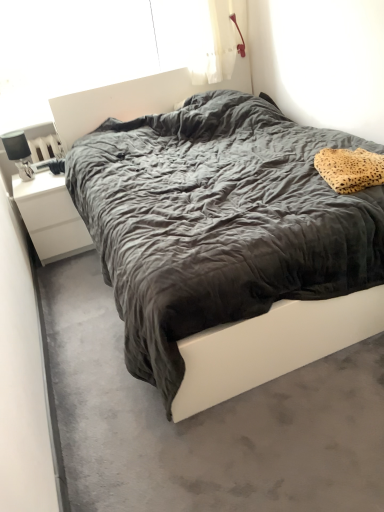
Question: Is velvet dark gray bed at center aimed at leopard print fabric pillow at upper right?

Choices:
 (A) yes
 (B) no

Answer: (A)

Question: From the image's perspective, is velvet dark gray bed at center on top of leopard print fabric pillow at upper right?

Choices:
 (A) yes
 (B) no

Answer: (A)

Question: Are velvet dark gray bed at center and leopard print fabric pillow at upper right beside each other?

Choices:
 (A) no
 (B) yes

Answer: (A)

Question: Can you confirm if velvet dark gray bed at center is wider than leopard print fabric pillow at upper right?

Choices:
 (A) no
 (B) yes

Answer: (B)

Question: Considering the relative sizes of velvet dark gray bed at center and leopard print fabric pillow at upper right in the image provided, is velvet dark gray bed at center shorter than leopard print fabric pillow at upper right?

Choices:
 (A) yes
 (B) no

Answer: (B)

Question: Considering the positions of leopard print fabric pillow at upper right and velvet dark gray bed at center in the image, is leopard print fabric pillow at upper right bigger or smaller than velvet dark gray bed at center?

Choices:
 (A) small
 (B) big

Answer: (A)

Question: In terms of height, does leopard print fabric pillow at upper right look taller or shorter compared to velvet dark gray bed at center?

Choices:
 (A) tall
 (B) short

Answer: (B)

Question: From a real-world perspective, relative to velvet dark gray bed at center, is leopard print fabric pillow at upper right vertically above or below?

Choices:
 (A) below
 (B) above

Answer: (B)

Question: From the image's perspective, is leopard print fabric pillow at upper right positioned above or below velvet dark gray bed at center?

Choices:
 (A) above
 (B) below

Answer: (B)

Question: Looking at their shapes, would you say leopard print fabric pillow at upper right is wider or thinner than transparent plastic window screen at upper center?

Choices:
 (A) thin
 (B) wide

Answer: (B)

Question: Do you think leopard print fabric pillow at upper right is within transparent plastic window screen at upper center, or outside of it?

Choices:
 (A) outside
 (B) inside

Answer: (A)

Question: From their relative heights in the image, would you say leopard print fabric pillow at upper right is taller or shorter than transparent plastic window screen at upper center?

Choices:
 (A) tall
 (B) short

Answer: (B)

Question: Does point (382, 173) appear closer or farther from the camera than point (208, 31)?

Choices:
 (A) farther
 (B) closer

Answer: (B)

Question: Considering the relative positions of matte black lamp at left and leopard print fabric pillow at upper right in the image provided, is matte black lamp at left to the left or to the right of leopard print fabric pillow at upper right?

Choices:
 (A) left
 (B) right

Answer: (A)

Question: Is point [6, 143] closer or farther from the camera than point [375, 164]?

Choices:
 (A) closer
 (B) farther

Answer: (B)